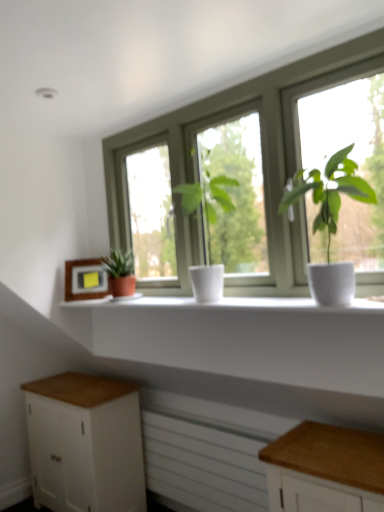
At what (x,y) coordinates should I click in order to perform the action: click on vacant area situated below wooden frame at left (from a real-world perspective). Please return your answer as a coordinate pair (x, y). The height and width of the screenshot is (512, 384). Looking at the image, I should click on (94, 308).